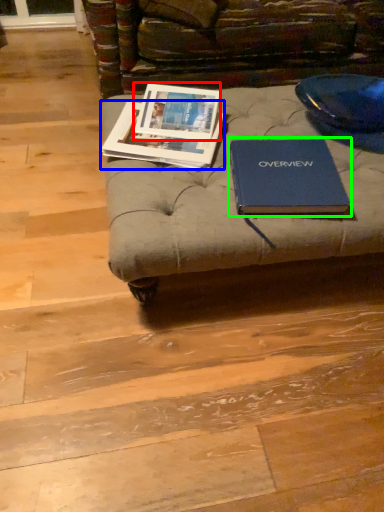
Question: Which object is positioned closest to book cover (highlighted by a red box)? Select from book (highlighted by a blue box) and book (highlighted by a green box).

Choices:
 (A) book
 (B) book

Answer: (A)